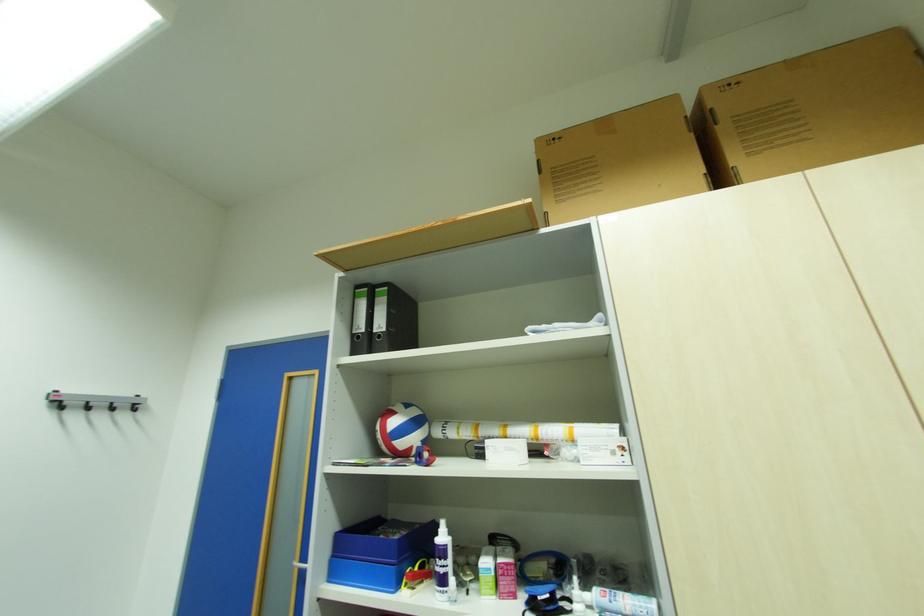
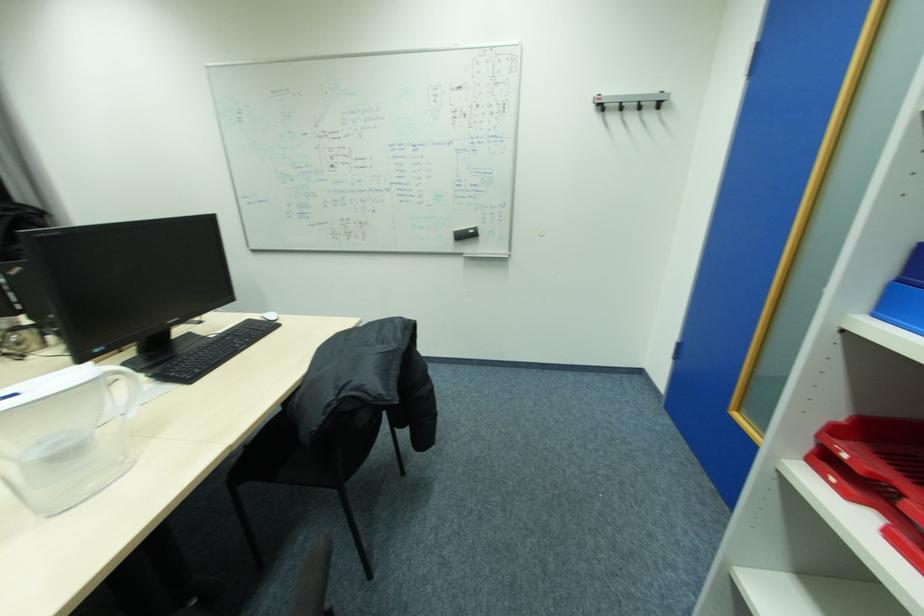
How did the camera likely rotate?

The camera rotated toward left-down.